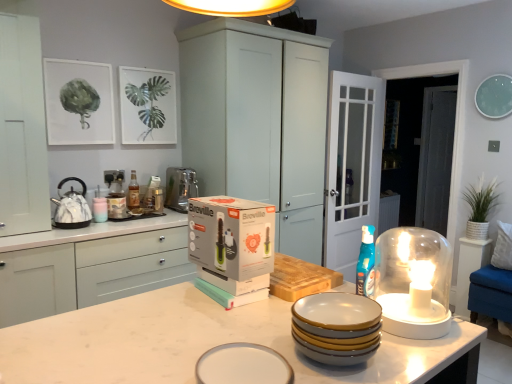
You are a GUI agent. You are given a task and a screenshot of the screen. Output one action in this format:
    pyautogui.click(x=<x>, y=<y>)
    Task: Click on the free spot below marble/textured kettle at left (from a real-world perspective)
    The width and height of the screenshot is (512, 384).
    Given the screenshot: What is the action you would take?
    pyautogui.click(x=76, y=222)